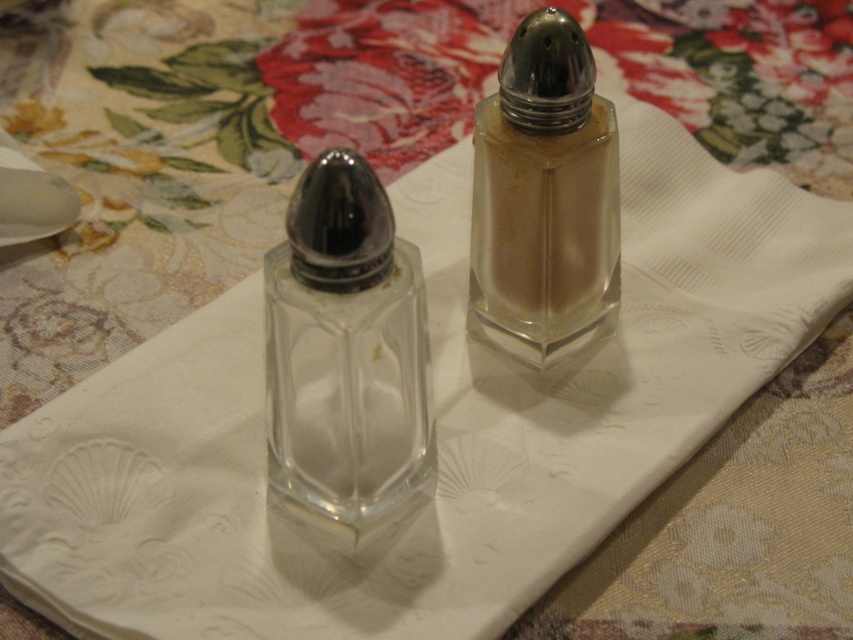
Is transparent glass salt shaker at center closer to the viewer compared to clear glass salt shaker at center?

That is True.

Between point (379, 182) and point (578, 147), which one is positioned behind?

The point (578, 147) is behind.

Find the location of `transparent glass salt shaker at center`. transparent glass salt shaker at center is located at coordinates (346, 356).